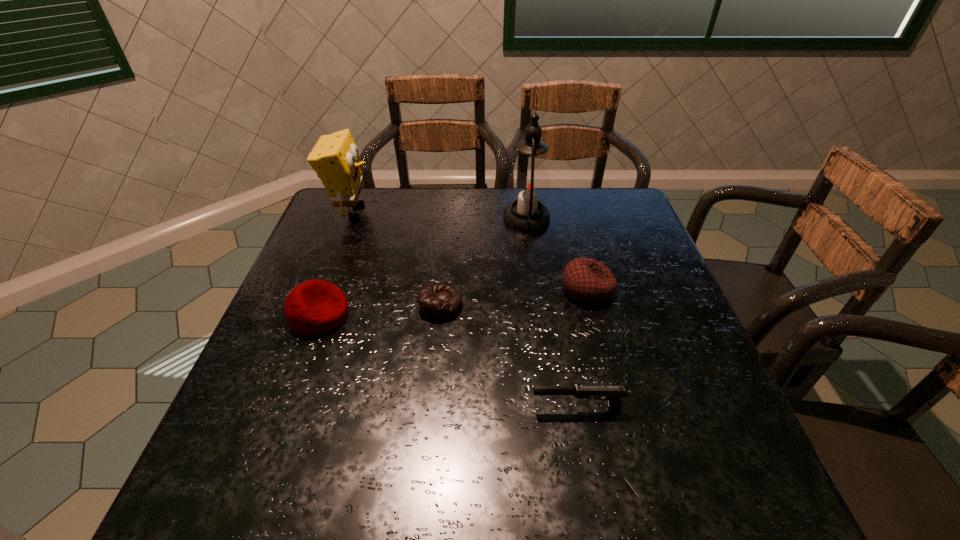
This screenshot has height=540, width=960. What are the coordinates of `the tallest object` in the screenshot? It's located at (529, 185).

Find the location of a particular element. Image resolution: width=960 pixels, height=540 pixels. the fifth shortest object is located at coordinates (335, 158).

Locate an element on the screen. the leftmost beanbag is located at coordinates (314, 307).

The height and width of the screenshot is (540, 960). In order to click on the rightmost beanbag in this screenshot , I will do `click(586, 280)`.

Find the location of a particular element. This screenshot has height=540, width=960. gun is located at coordinates (613, 394).

Find the location of a particular element. the shortest object is located at coordinates (438, 302).

Locate an element on the screen. Image resolution: width=960 pixels, height=540 pixels. the shortest beanbag is located at coordinates (438, 302).

The height and width of the screenshot is (540, 960). Identify the location of vacant area situated on the front of the oil lamp. (543, 341).

At what (x,y) coordinates should I click in order to perform the action: click on free spot located on the face of the sponge. Please return your answer as a coordinate pair (x, y). This screenshot has width=960, height=540. Looking at the image, I should click on (490, 211).

You are a GUI agent. You are given a task and a screenshot of the screen. Output one action in this format:
    pyautogui.click(x=<x>, y=<y>)
    Task: Click on the vacant space situated on the seat area of the leftmost beanbag
    
    Given the screenshot: What is the action you would take?
    pyautogui.click(x=487, y=315)